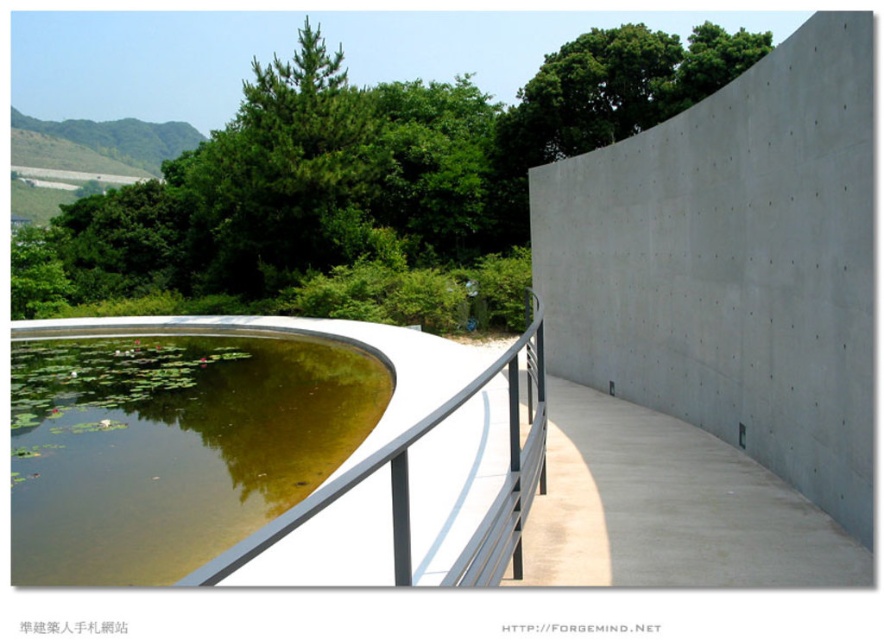
Is green leafy tree at upper center bigger than greenish water at center?

Yes, green leafy tree at upper center is bigger than greenish water at center.

Between point (509, 132) and point (82, 563), which one is positioned in front?

Positioned in front is point (82, 563).

Who is more distant from viewer, (63, 209) or (42, 385)?

The point (63, 209) is more distant.

The height and width of the screenshot is (640, 884). Identify the location of green leafy tree at upper center. (362, 172).

Is point (141, 460) closer to viewer compared to point (492, 570)?

No.

Can you confirm if greenish water at center is smaller than metallic silver balustrade at lower left?

Actually, greenish water at center might be larger than metallic silver balustrade at lower left.

Find the location of a particular element. The image size is (884, 640). greenish water at center is located at coordinates (171, 445).

Between smooth concrete path at center and metallic silver balustrade at lower left, which one appears on the left side from the viewer's perspective?

Positioned to the left is metallic silver balustrade at lower left.

Which is above, smooth concrete path at center or metallic silver balustrade at lower left?

metallic silver balustrade at lower left is higher up.

Describe the element at coordinates (669, 508) in the screenshot. I see `smooth concrete path at center` at that location.

This screenshot has height=640, width=884. I want to click on smooth concrete path at center, so click(x=669, y=508).